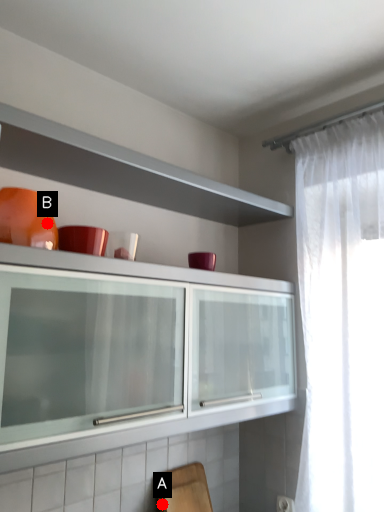
Question: Two points are circled on the image, labeled by A and B beside each circle. Which point is closer to the camera taking this photo?

Choices:
 (A) A is closer
 (B) B is closer

Answer: (B)